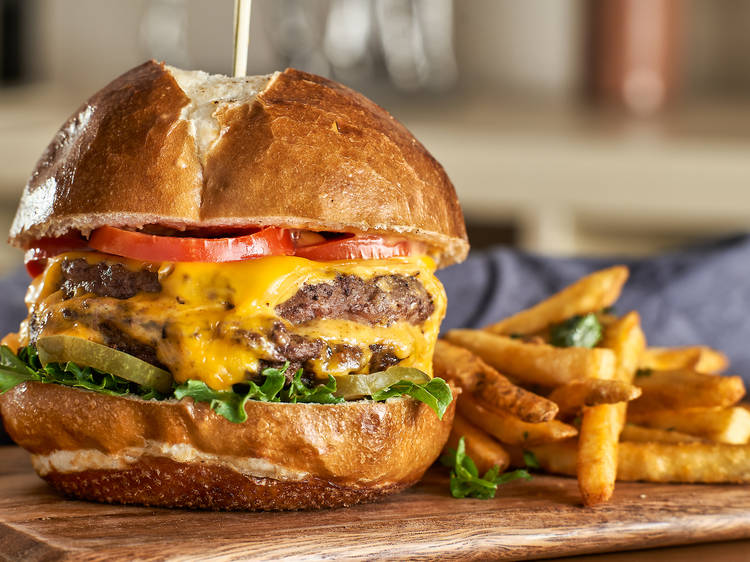
You are a GUI agent. You are given a task and a screenshot of the screen. Output one action in this format:
    pyautogui.click(x=<x>, y=<y>)
    Task: Click on the pillow
    
    Given the screenshot: What is the action you would take?
    pyautogui.click(x=676, y=288)